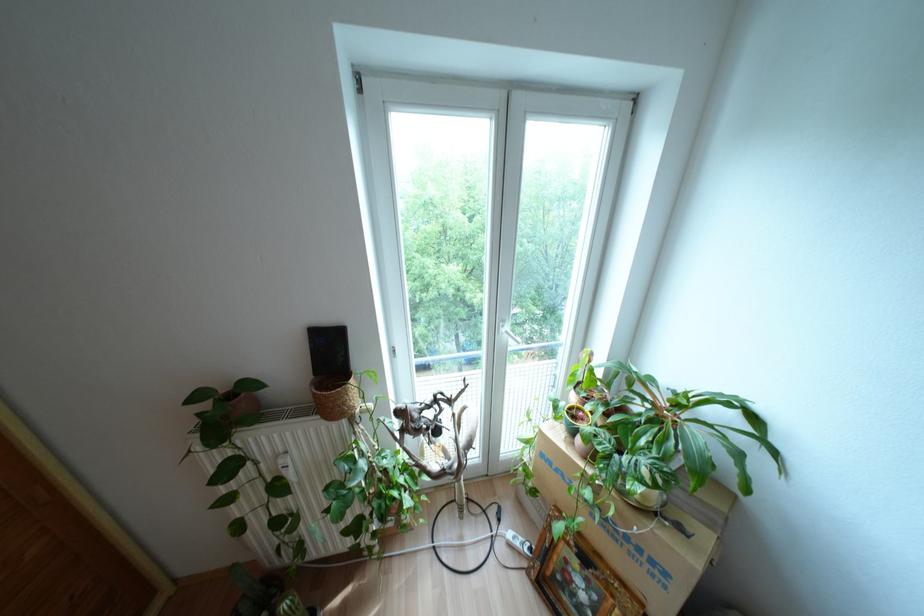
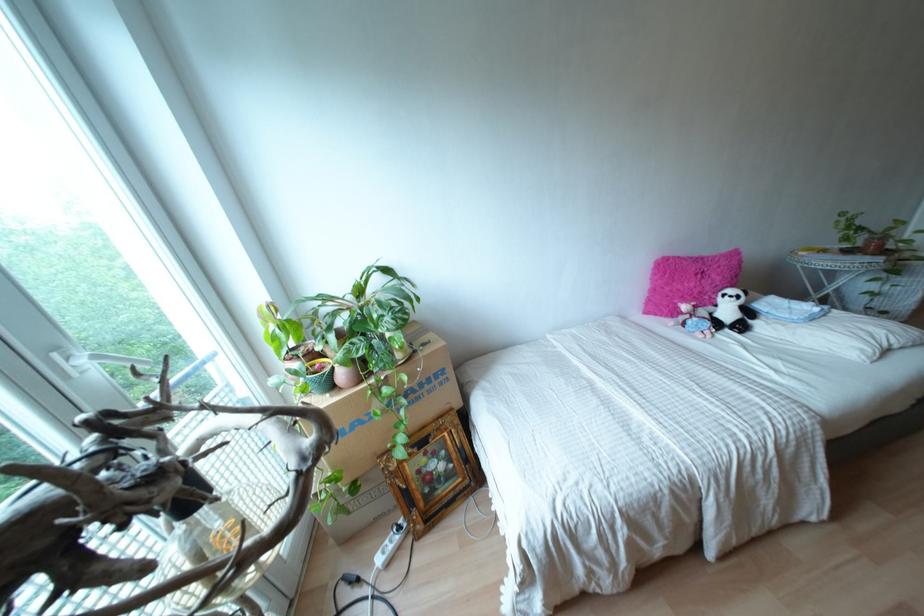
Locate, in the second image, the point that corresponds to point 579,439 in the first image.

(342, 374)